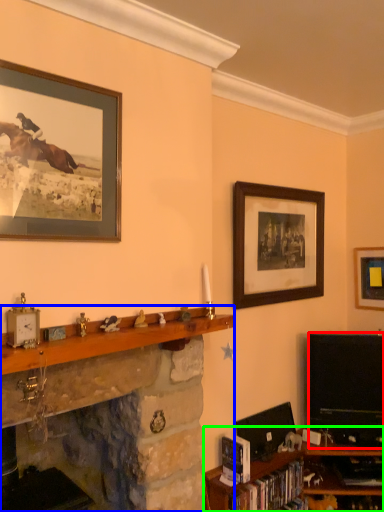
Question: Considering the real-world distances, which object is farthest from television (highlighted by a red box)? shelf (highlighted by a blue box) or shelf (highlighted by a green box)?

Choices:
 (A) shelf
 (B) shelf

Answer: (A)